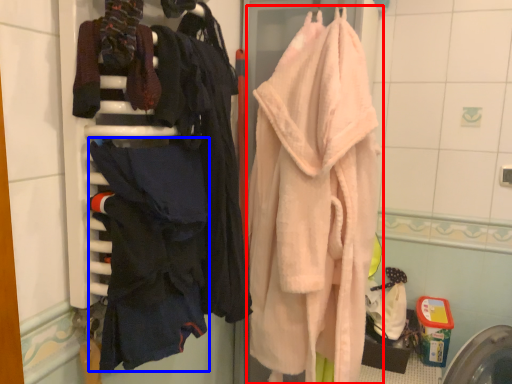
Question: Among these objects, which one is farthest to the camera, towel (highlighted by a red box) or clothing (highlighted by a blue box)?

Choices:
 (A) towel
 (B) clothing

Answer: (A)